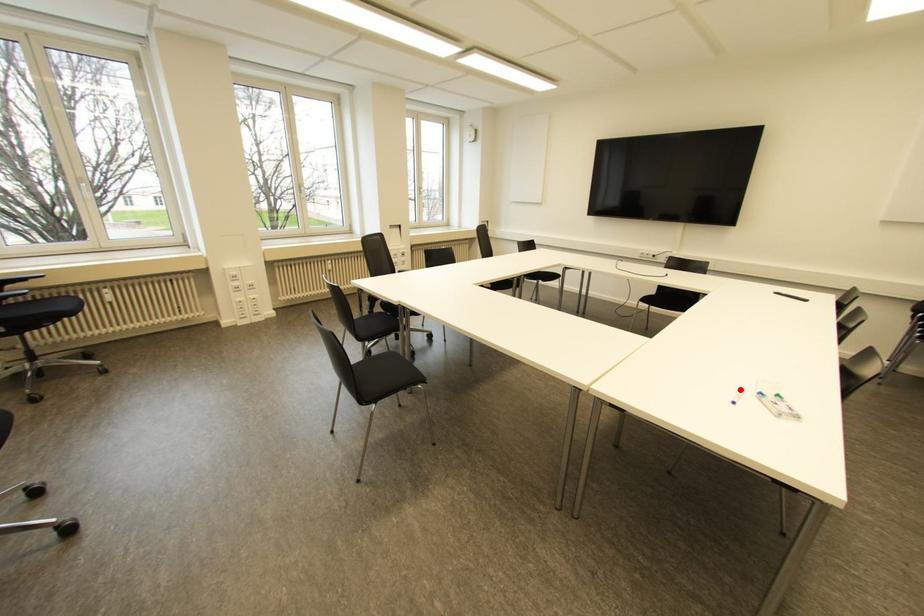
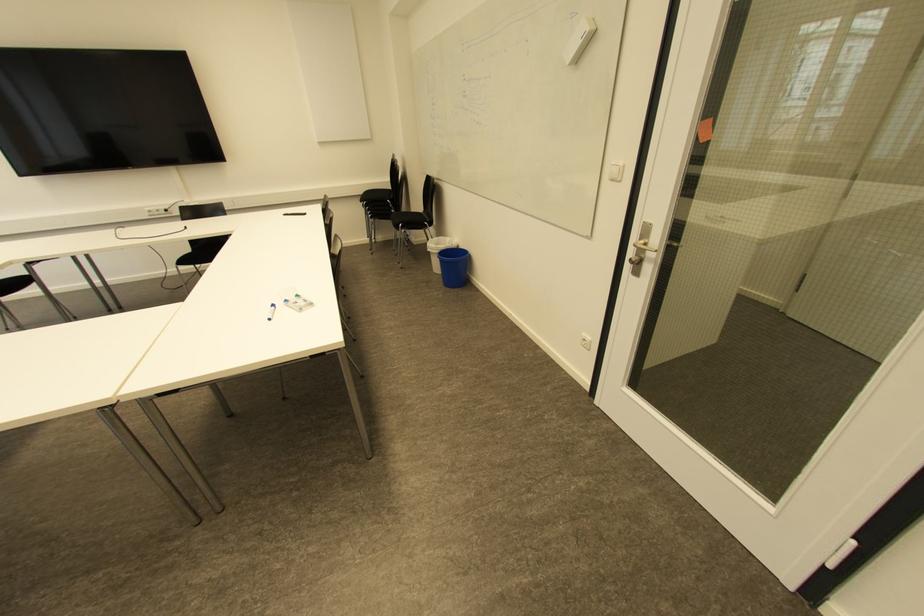
Find the pixel in the second image that matches the highlighted location in the first image.

(273, 306)